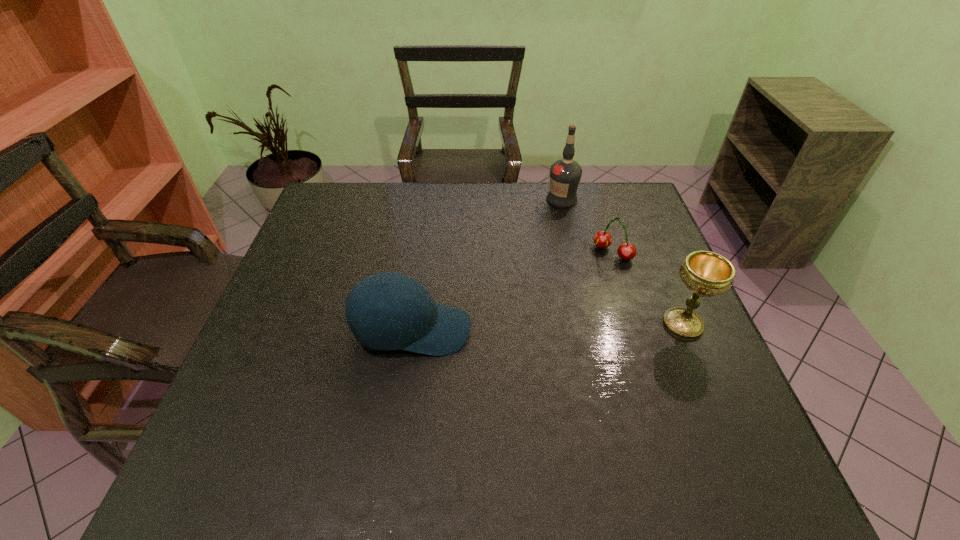
This screenshot has height=540, width=960. In order to click on free space between the second object from left to right and the third shortest object in this screenshot , I will do `click(622, 262)`.

This screenshot has height=540, width=960. Identify the location of free space between the rightmost object and the vodka. (622, 262).

At what (x,y) coordinates should I click in order to perform the action: click on vacant point located between the baseball cap and the farthest object. Please return your answer as a coordinate pair (x, y). Image resolution: width=960 pixels, height=540 pixels. Looking at the image, I should click on (487, 265).

Locate an element on the screen. The image size is (960, 540). object that can be found as the third closest to the second object from right to left is located at coordinates (419, 325).

The height and width of the screenshot is (540, 960). I want to click on object that is the third closest to the second object from left to right, so click(419, 325).